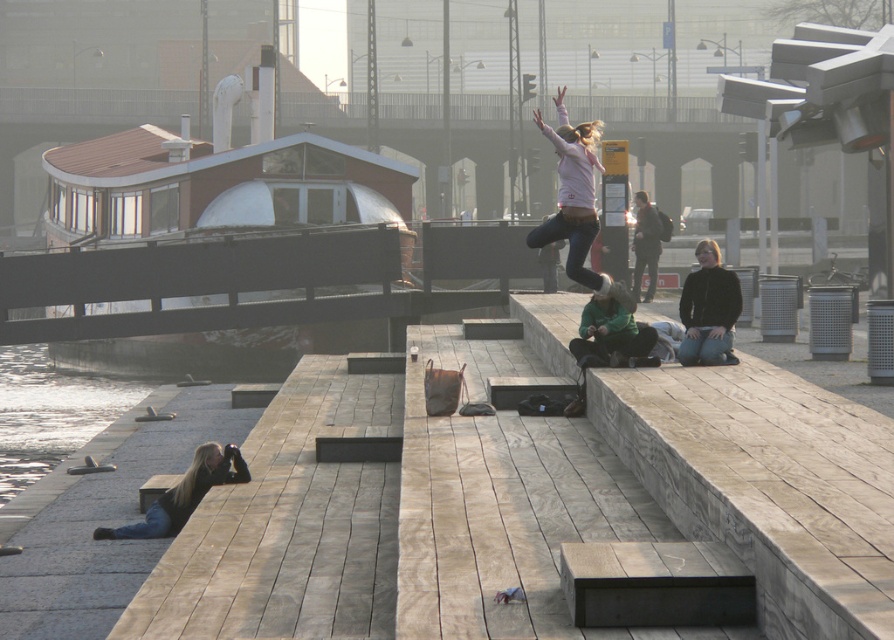
Question: Which is farther from the black leather jacket at center?

Choices:
 (A) dark brown leather jacket at upper center
 (B) wooden bench at center
 (C) matte pink sweater at upper center

Answer: (A)

Question: Among these points, which one is farthest from the camera?

Choices:
 (A) (578, 216)
 (B) (94, 538)
 (C) (259, 452)

Answer: (A)

Question: Is wooden bench at center thinner than dark brown leather jacket at upper center?

Choices:
 (A) yes
 (B) no

Answer: (B)

Question: Which object appears closest to the camera in this image?

Choices:
 (A) blonde hair at lower left
 (B) wooden dock at lower left
 (C) dark brown leather jacket at upper center
 (D) black leather jacket at center

Answer: (B)

Question: Is black leather jacket at center above blonde hair at lower left?

Choices:
 (A) yes
 (B) no

Answer: (A)

Question: Is matte pink sweater at upper center positioned behind dark brown leather jacket at upper center?

Choices:
 (A) no
 (B) yes

Answer: (A)